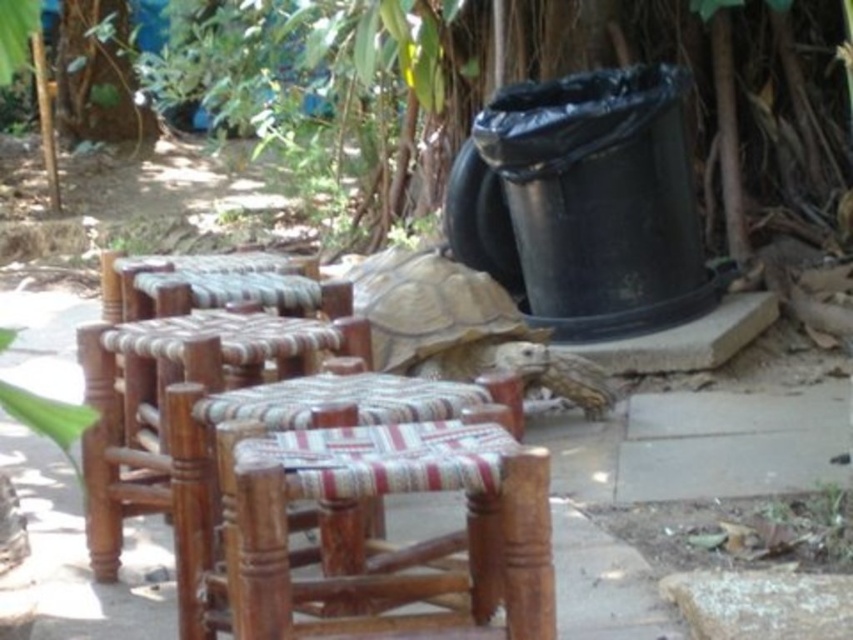
Question: Does wooden stool at left have a greater width compared to brown textured shell at center?

Choices:
 (A) no
 (B) yes

Answer: (B)

Question: Which object appears closest to the camera in this image?

Choices:
 (A) wooden stool at left
 (B) brown textured shell at center

Answer: (A)

Question: Is wooden stool at left behind brown textured shell at center?

Choices:
 (A) no
 (B) yes

Answer: (A)

Question: Does wooden stool at left have a larger size compared to brown textured shell at center?

Choices:
 (A) no
 (B) yes

Answer: (B)